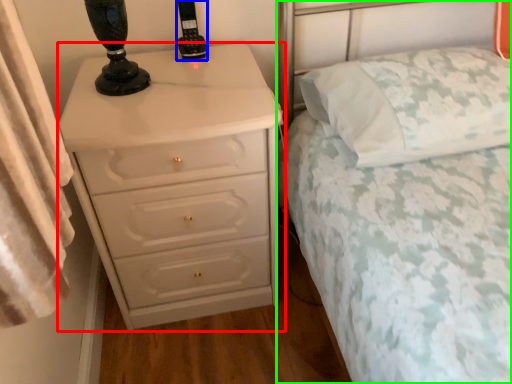
Question: Estimate the real-world distances between objects in this image. Which object is closer to chest of drawers (highlighted by a red box), control (highlighted by a blue box) or bed (highlighted by a green box)?

Choices:
 (A) control
 (B) bed

Answer: (B)